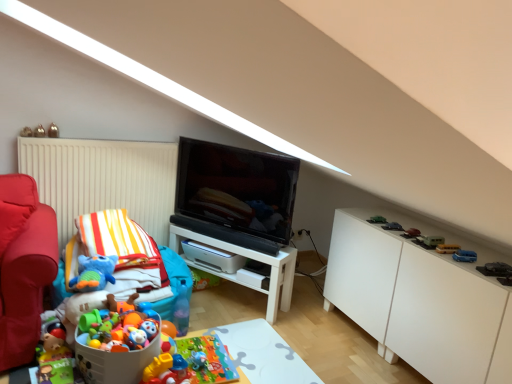
At what (x,y) coordinates should I click in order to perform the action: click on vacant area situated to the left side of blue plastic toy car at lower right, the 5th toy ordered from the bottom. Please return your answer as a coordinate pair (x, y). Looking at the image, I should click on pos(441,252).